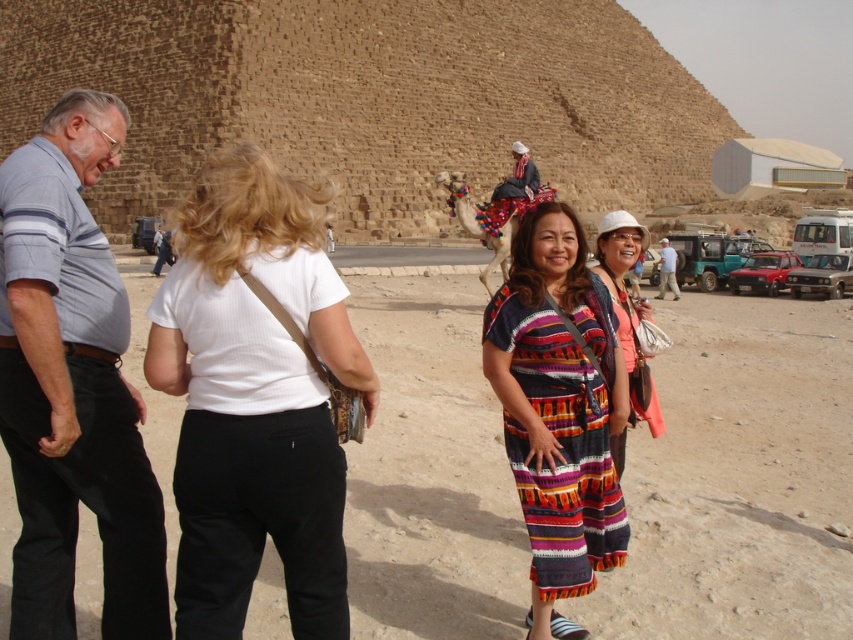
Which of these two, gray striped shirt at left or white woven hat at center, stands taller?

Standing taller between the two is gray striped shirt at left.

Does gray striped shirt at left appear over white woven hat at center?

Yes, gray striped shirt at left is above white woven hat at center.

I want to click on gray striped shirt at left, so click(73, 385).

Who is positioned more to the right, gray striped shirt at left or multicolored woven dress at center?

Positioned to the right is multicolored woven dress at center.

Which is in front, point (144, 595) or point (596, 355)?

Point (144, 595) is more forward.

This screenshot has height=640, width=853. I want to click on gray striped shirt at left, so click(73, 385).

Is brown stone pyramid at upper center above gray striped shirt at left?

Yes, brown stone pyramid at upper center is above gray striped shirt at left.

Which of these two, brown stone pyramid at upper center or gray striped shirt at left, stands taller?

With more height is brown stone pyramid at upper center.

Locate an element on the screen. This screenshot has height=640, width=853. brown stone pyramid at upper center is located at coordinates (370, 97).